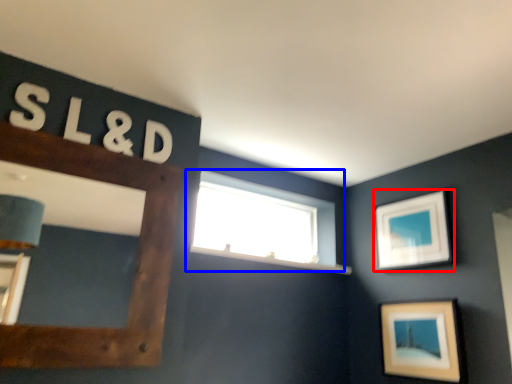
Question: Among these objects, which one is farthest to the camera, picture frame (highlighted by a red box) or window (highlighted by a blue box)?

Choices:
 (A) picture frame
 (B) window

Answer: (B)